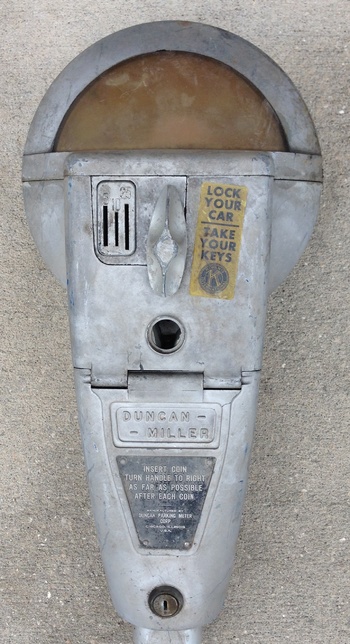
Where is `wall`? The image size is (350, 644). wall is located at coordinates (299, 475).